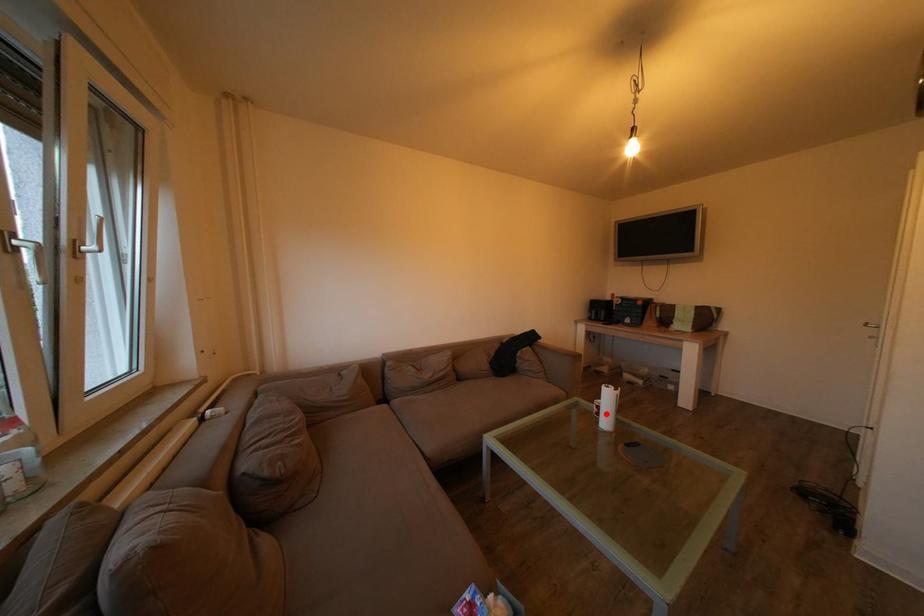
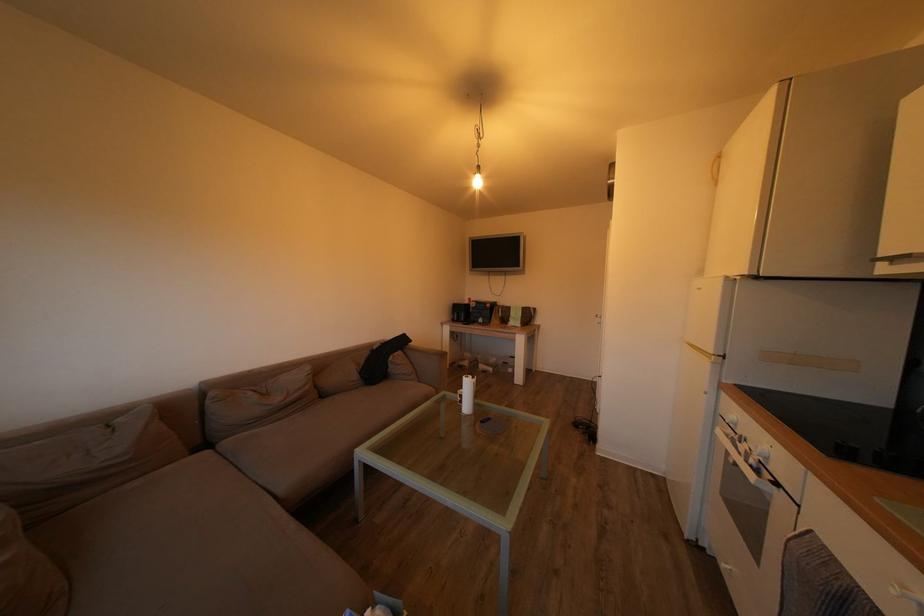
Question: I am providing you with two images of the same scene from different viewpoints. Image1 has a red point marked. In image2, the corresponding 3D location appears at what relative position? Reply with the corresponding letter.

Choices:
 (A) Closer
 (B) Farther

Answer: (B)